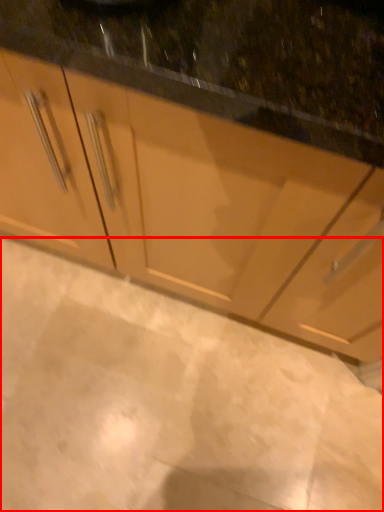
Question: In this image, where is granite (annotated by the red box) located relative to cabinetry?

Choices:
 (A) right
 (B) left

Answer: (B)